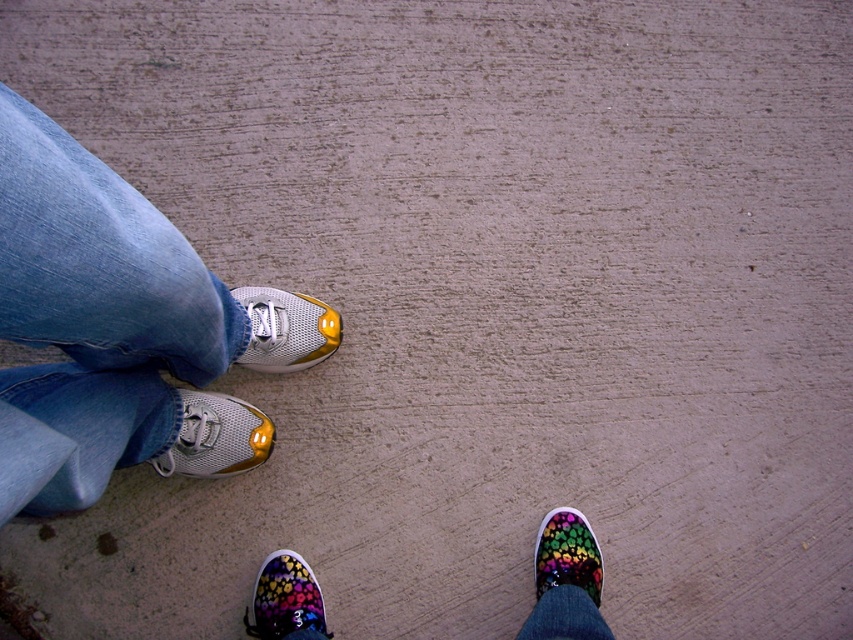
You are a photographer trying to capture both pairs of feet in a balanced composition. Given that the multicolored canvas sneakers at lower right and the floral canvas sneaker at lower right are both in the frame, which pair should you position closer to the center to maintain symmetry?

The multicolored canvas sneakers at lower right should be positioned closer to the center since they are wider than the floral canvas sneaker at lower right, balancing the composition by accounting for their larger size.

You are trying to decide which pair of sneakers to take home from the store. Both the multicolored canvas sneakers at lower right and the floral canvas sneaker at lower right are in your size. However, you have a small storage space. Which one should you choose based on their sizes?

The multicolored canvas sneakers at lower right is bigger than the floral canvas sneaker at lower right, so choosing the floral canvas sneaker at lower right would be better for limited storage space.

Based on the photo, you are a photographer taking a picture of two pairs of shoes. You notice the shiny metallic sneaker at left and the multicolored canvas shoe at lower right. Based on the scene, which shoe appears closer to the camera?

The shiny metallic sneaker at left appears closer to the camera because it is positioned above the multicolored canvas shoe at lower right, indicating it is nearer in the visual plane.